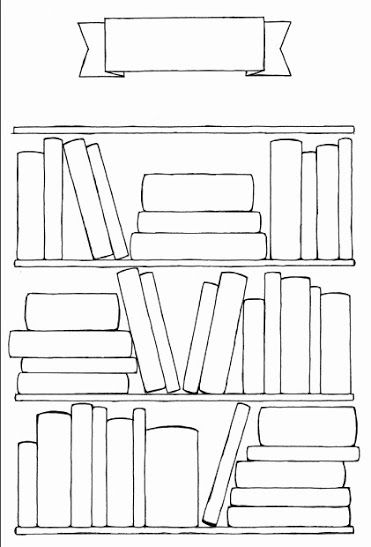
Locate an element on the screen. shelves is located at coordinates [x=207, y=129], [x=176, y=263], [x=181, y=398], [x=174, y=531].